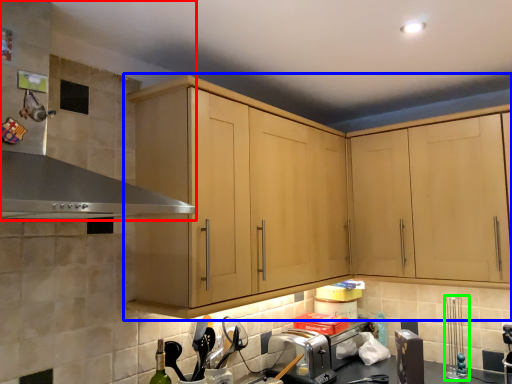
Question: Which is farther away from exhaust hood (highlighted by a red box)? cabinetry (highlighted by a blue box) or appliance (highlighted by a green box)?

Choices:
 (A) cabinetry
 (B) appliance

Answer: (B)